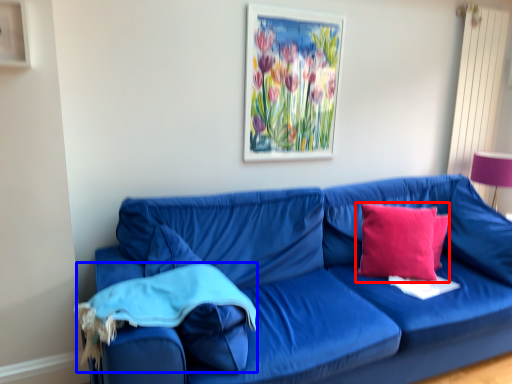
Question: Which point is further to the camera, pillow (highlighted by a red box) or material (highlighted by a blue box)?

Choices:
 (A) pillow
 (B) material

Answer: (A)